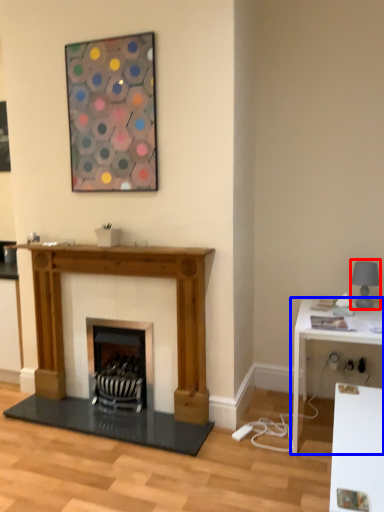
Question: Which point is closer to the camera, lamp (highlighted by a red box) or table (highlighted by a blue box)?

Choices:
 (A) lamp
 (B) table

Answer: (B)